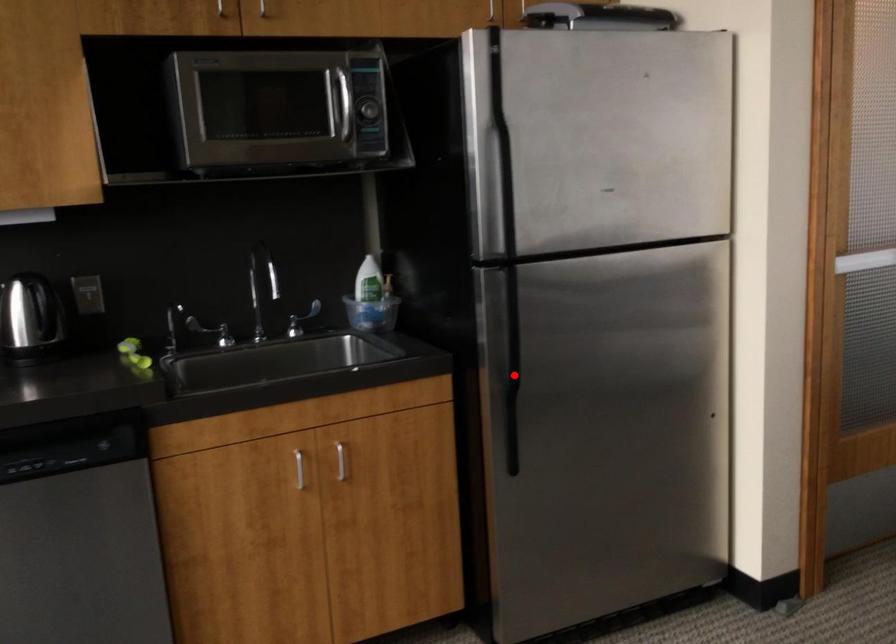
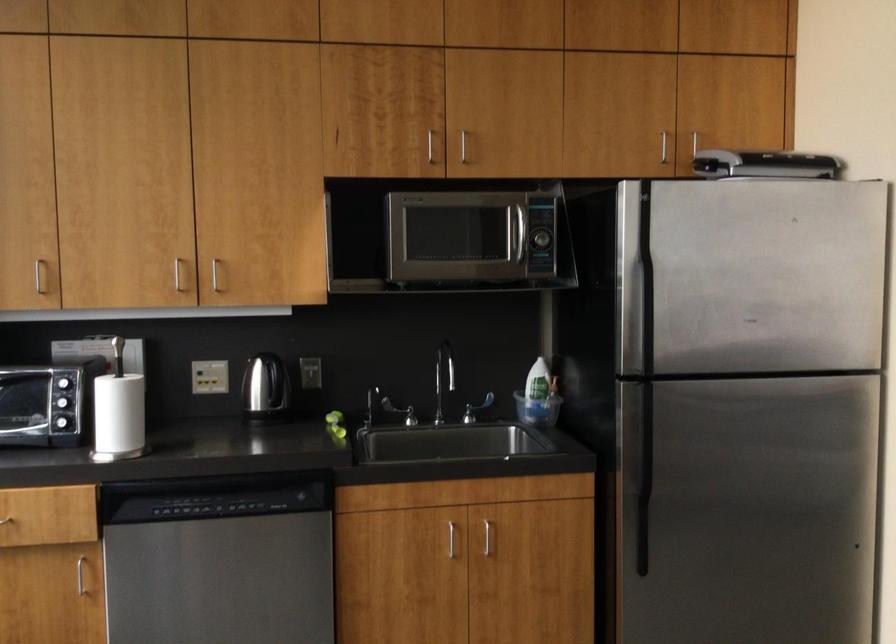
In the second image, find the point that corresponds to the highlighted location in the first image.

(643, 480)